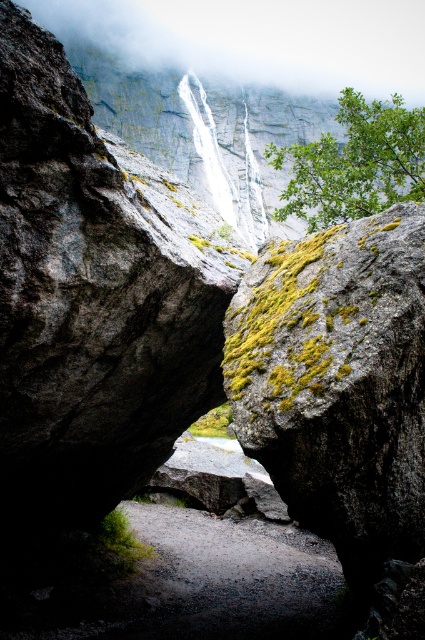
Does white misty fog at upper center have a greater height compared to gray gravel path at center?

Indeed, white misty fog at upper center has a greater height compared to gray gravel path at center.

Which of these two, white misty fog at upper center or gray gravel path at center, stands taller?

Standing taller between the two is white misty fog at upper center.

Between point (161, 49) and point (215, 605), which one is positioned behind?

The point (161, 49) is more distant.

Find the location of a particular element. white misty fog at upper center is located at coordinates (235, 68).

How much distance is there between gray gravel path at center and white smooth waterfall at center?

The distance of gray gravel path at center from white smooth waterfall at center is 40.50 meters.

Is gray gravel path at center below white smooth waterfall at center?

Yes.

Measure the distance between gray gravel path at center and camera.

gray gravel path at center and camera are 20.47 feet apart.

This screenshot has height=640, width=425. I want to click on gray gravel path at center, so click(x=229, y=579).

Is the position of white misty fog at upper center less distant than that of white smooth waterfall at center?

No, white misty fog at upper center is behind white smooth waterfall at center.

Does white misty fog at upper center lie behind white smooth waterfall at center?

That is True.

Find the location of a particular element. The height and width of the screenshot is (640, 425). white misty fog at upper center is located at coordinates (235, 68).

In order to click on white misty fog at upper center in this screenshot , I will do `click(235, 68)`.